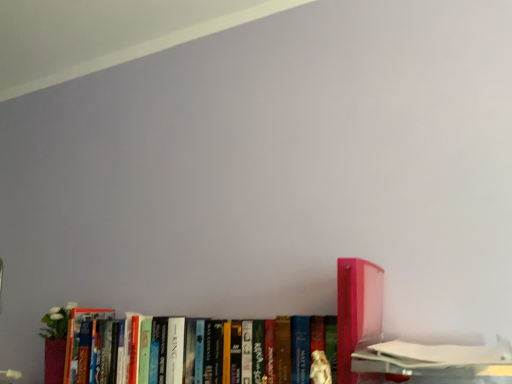
Question: Does matte cardboard book at lower right, which is the 1th book from right to left, have a greater height compared to hardcover book at center, arranged as the first book when viewed from the left?

Choices:
 (A) no
 (B) yes

Answer: (A)

Question: From the image's perspective, is matte cardboard book at lower right, which is the 3th book in left-to-right order, above hardcover book at center, marked as the third book in a right-to-left arrangement?

Choices:
 (A) yes
 (B) no

Answer: (A)

Question: From the image's perspective, does matte cardboard book at lower right, which is the 1th book from right to left, appear lower than hardcover book at center, marked as the third book in a right-to-left arrangement?

Choices:
 (A) no
 (B) yes

Answer: (A)

Question: Is matte cardboard book at lower right, which is the 1th book from right to left, at the right side of hardcover book at center, arranged as the first book when viewed from the left?

Choices:
 (A) yes
 (B) no

Answer: (A)

Question: Is matte cardboard book at lower right, which is the 1th book from right to left, oriented towards hardcover book at center, marked as the third book in a right-to-left arrangement?

Choices:
 (A) yes
 (B) no

Answer: (B)

Question: From a real-world perspective, relative to hardcover book at center, arranged as the first book when viewed from the left, is pink plastic book at right, the second book positioned from the right, vertically above or below?

Choices:
 (A) above
 (B) below

Answer: (A)

Question: Is pink plastic book at right, the second book positioned from the right, to the left or to the right of hardcover book at center, marked as the third book in a right-to-left arrangement, in the image?

Choices:
 (A) left
 (B) right

Answer: (B)

Question: Is pink plastic book at right, the second book positioned from the right, bigger or smaller than hardcover book at center, marked as the third book in a right-to-left arrangement?

Choices:
 (A) small
 (B) big

Answer: (A)

Question: Is point (359, 304) positioned closer to the camera than point (189, 347)?

Choices:
 (A) closer
 (B) farther

Answer: (A)

Question: In terms of width, does pink plastic book at right, placed as the second book when sorted from left to right, look wider or thinner when compared to matte cardboard book at lower right, which is the 1th book from right to left?

Choices:
 (A) wide
 (B) thin

Answer: (B)

Question: From the image's perspective, is pink plastic book at right, placed as the second book when sorted from left to right, located above or below matte cardboard book at lower right, which is the 3th book in left-to-right order?

Choices:
 (A) below
 (B) above

Answer: (B)

Question: Considering the positions of pink plastic book at right, placed as the second book when sorted from left to right, and matte cardboard book at lower right, which is the 1th book from right to left, in the image, is pink plastic book at right, placed as the second book when sorted from left to right, taller or shorter than matte cardboard book at lower right, which is the 1th book from right to left,?

Choices:
 (A) tall
 (B) short

Answer: (A)

Question: In terms of size, does pink plastic book at right, the second book positioned from the right, appear bigger or smaller than matte cardboard book at lower right, which is the 3th book in left-to-right order?

Choices:
 (A) big
 (B) small

Answer: (B)

Question: From a real-world perspective, is matte cardboard book at lower right, which is the 1th book from right to left, positioned above or below pink plastic book at right, placed as the second book when sorted from left to right?

Choices:
 (A) above
 (B) below

Answer: (B)

Question: Considering the positions of point (438, 355) and point (369, 316), is point (438, 355) closer or farther from the camera than point (369, 316)?

Choices:
 (A) farther
 (B) closer

Answer: (B)